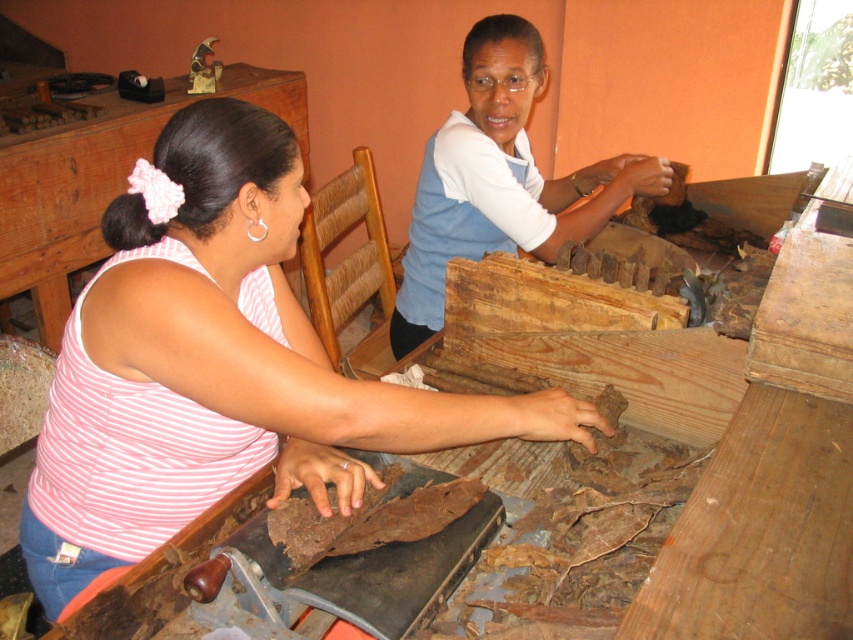
You are designing a new line of clothing and need to compare the sizes of the pink striped tank top at center and the blue cotton shirt at upper center in the image. Which one has a larger size?

The pink striped tank top at center is bigger than the blue cotton shirt at upper center.

You are observing two people in a workshop. You notice the pink striped tank top at center and the blue cotton shirt at upper center. Which clothing item is positioned to the left?

The pink striped tank top at center is to the left of the blue cotton shirt at upper center.

You are a visitor in the workshop and want to greet the person wearing the pink striped tank top at center. Which direction should you move to get closer to them compared to the blue cotton shirt at upper center?

The pink striped tank top at center is closer to the viewer than the blue cotton shirt at upper center, so you should move forward towards the pink striped tank top at center to get closer to them while moving away from the blue cotton shirt at upper center.